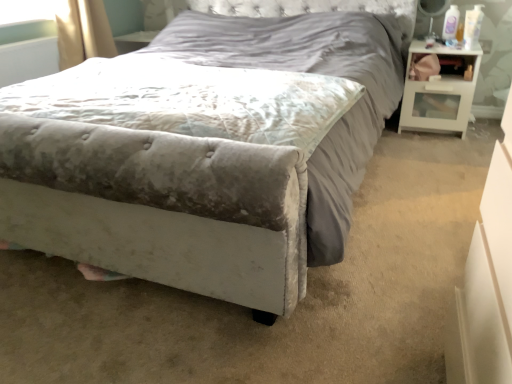
This screenshot has height=384, width=512. Describe the element at coordinates (184, 191) in the screenshot. I see `velvet gray bed at center` at that location.

Image resolution: width=512 pixels, height=384 pixels. Find the location of `white glossy nightstand at right`. white glossy nightstand at right is located at coordinates (439, 91).

Is velvet gray mattress at center looking in the opposite direction of white glossy nightstand at right?

No, velvet gray mattress at center is not facing the opposite direction of white glossy nightstand at right.

Does velvet gray mattress at center come behind white glossy nightstand at right?

That is False.

From the image's perspective, between velvet gray mattress at center and white glossy nightstand at right, who is located below?

velvet gray mattress at center appears lower in the image.

Does point (85, 103) come behind point (462, 120)?

No, it is not.

From the picture: Considering the relative sizes of velvet gray mattress at center and velvet gray bed at center in the image provided, is velvet gray mattress at center wider than velvet gray bed at center?

No, velvet gray mattress at center is not wider than velvet gray bed at center.

Does velvet gray mattress at center have a larger size compared to velvet gray bed at center?

Incorrect, velvet gray mattress at center is not larger than velvet gray bed at center.

From a real-world perspective, does velvet gray mattress at center sit lower than velvet gray bed at center?

No, from a real-world perspective, velvet gray mattress at center is not under velvet gray bed at center.

Is velvet gray mattress at center positioned with its back to velvet gray bed at center?

Yes, velvet gray mattress at center is facing away from velvet gray bed at center.

How different are the orientations of white glossy nightstand at right and velvet gray bed at center in degrees?

The angle between the facing direction of white glossy nightstand at right and the facing direction of velvet gray bed at center is 1.09 degrees.

From the picture: Between white glossy nightstand at right and velvet gray bed at center, which one has larger width?

velvet gray bed at center is wider.

From a real-world perspective, which object rests below the other?

white glossy nightstand at right, from a real-world perspective.

From the image's perspective, does white glossy nightstand at right appear higher than velvet gray bed at center?

Yes.

Would you say velvet gray bed at center is a long distance from white glossy nightstand at right?

That's not correct — velvet gray bed at center is a little close to white glossy nightstand at right.

Which is more to the right, velvet gray bed at center or white glossy nightstand at right?

white glossy nightstand at right.

Is velvet gray bed at center shorter than white glossy nightstand at right?

No.

Choose the correct answer: Is velvet gray bed at center inside white glossy nightstand at right or outside it?

velvet gray bed at center is located beyond the bounds of white glossy nightstand at right.

Looking at this image, who is taller, white glossy nightstand at right or velvet gray mattress at center?

With more height is white glossy nightstand at right.

Does white glossy nightstand at right lie in front of velvet gray mattress at center?

Result: No, it is behind velvet gray mattress at center.

Could you tell me if white glossy nightstand at right is facing velvet gray mattress at center?

No.

Is white glossy nightstand at right positioned beyond the bounds of velvet gray mattress at center?

white glossy nightstand at right lies outside velvet gray mattress at center's area.

Does point (240, 238) come farther from viewer compared to point (288, 106)?

No, (240, 238) is in front of (288, 106).

Are velvet gray bed at center and velvet gray mattress at center far apart?

No.

Is velvet gray bed at center oriented away from velvet gray mattress at center?

No, velvet gray bed at center is not facing the opposite direction of velvet gray mattress at center.

Between velvet gray bed at center and velvet gray mattress at center, which one has more height?

velvet gray bed at center.

There is a white glossy nightstand at right. Where is `mattress above it (from a real-world perspective)`? The image size is (512, 384). mattress above it (from a real-world perspective) is located at coordinates (190, 100).

Locate an element on the screen. The height and width of the screenshot is (384, 512). bed that appears on the right of velvet gray mattress at center is located at coordinates (184, 191).

Based on their spatial positions, is white glossy nightstand at right or velvet gray mattress at center closer to velvet gray bed at center?

Among the two, velvet gray mattress at center is located nearer to velvet gray bed at center.

Looking at the image, which one is located further to white glossy nightstand at right, velvet gray bed at center or velvet gray mattress at center?

velvet gray mattress at center is further to white glossy nightstand at right.

Based on their spatial positions, is velvet gray bed at center or white glossy nightstand at right closer to velvet gray mattress at center?

Among the two, velvet gray bed at center is located nearer to velvet gray mattress at center.

Estimate the real-world distances between objects in this image. Which object is closer to velvet gray mattress at center, white glossy nightstand at right or velvet gray bed at center?

The object closer to velvet gray mattress at center is velvet gray bed at center.

From the picture: When comparing their distances from velvet gray bed at center, does velvet gray mattress at center or white glossy nightstand at right seem closer?

velvet gray mattress at center is closer to velvet gray bed at center.

Looking at the image, which one is located further to white glossy nightstand at right, velvet gray mattress at center or velvet gray bed at center?

Among the two, velvet gray mattress at center is located further to white glossy nightstand at right.

Find the location of a particular element. mattress between velvet gray bed at center and white glossy nightstand at right in the front-back direction is located at coordinates 190,100.